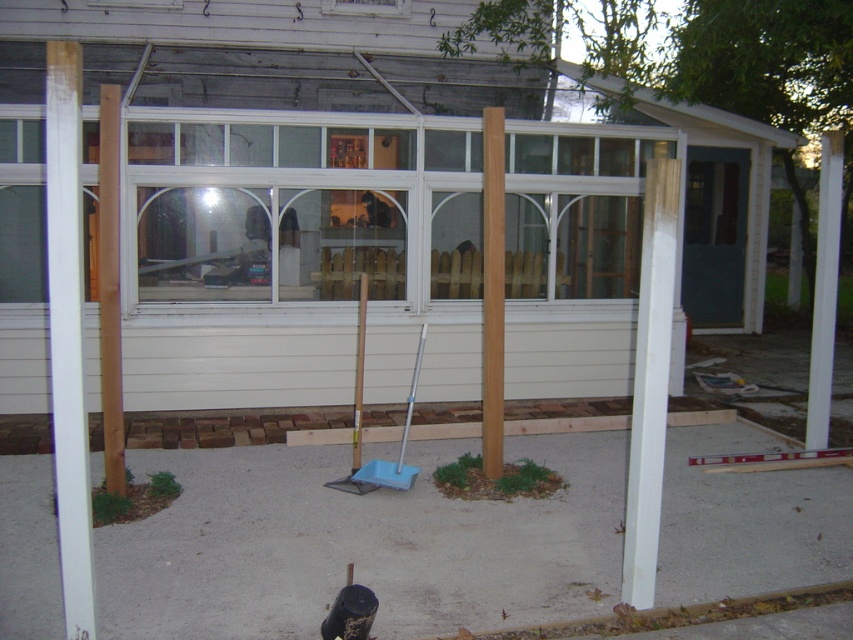
Is green matte screen door at right thinner than metallic silver shovel at center?

No, green matte screen door at right is not thinner than metallic silver shovel at center.

Does green matte screen door at right appear on the left side of metallic silver shovel at center?

In fact, green matte screen door at right is to the right of metallic silver shovel at center.

Is point (711, 216) positioned behind point (410, 468)?

Yes, point (711, 216) is farther from viewer.

At what (x,y) coordinates should I click in order to perform the action: click on green matte screen door at right. Please return your answer as a coordinate pair (x, y). Looking at the image, I should click on (714, 236).

Which of these two, light brown wood pole at left or light brown wood pole at center, stands shorter?

Standing shorter between the two is light brown wood pole at center.

Can you confirm if light brown wood pole at left is wider than light brown wood pole at center?

Yes, light brown wood pole at left is wider than light brown wood pole at center.

Locate an element on the screen. This screenshot has width=853, height=640. light brown wood pole at left is located at coordinates (109, 289).

Find the location of a particular element. Image resolution: width=853 pixels, height=640 pixels. light brown wood pole at left is located at coordinates (109, 289).

Which of these two, green matte screen door at right or light brown wood pole at left, stands taller?

green matte screen door at right

Which is in front, point (688, 237) or point (111, 214)?

Positioned in front is point (111, 214).

What are the coordinates of `green matte screen door at right` in the screenshot? It's located at (714, 236).